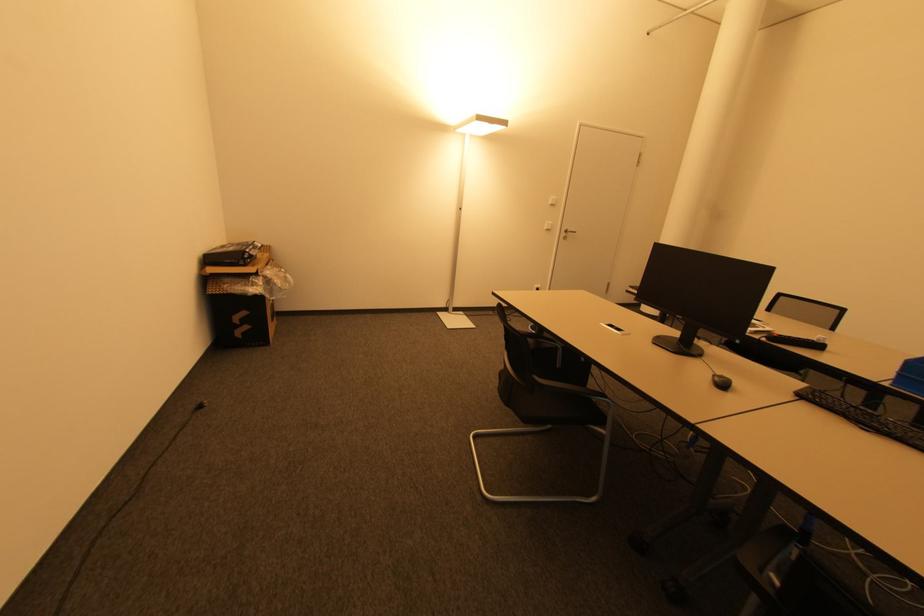
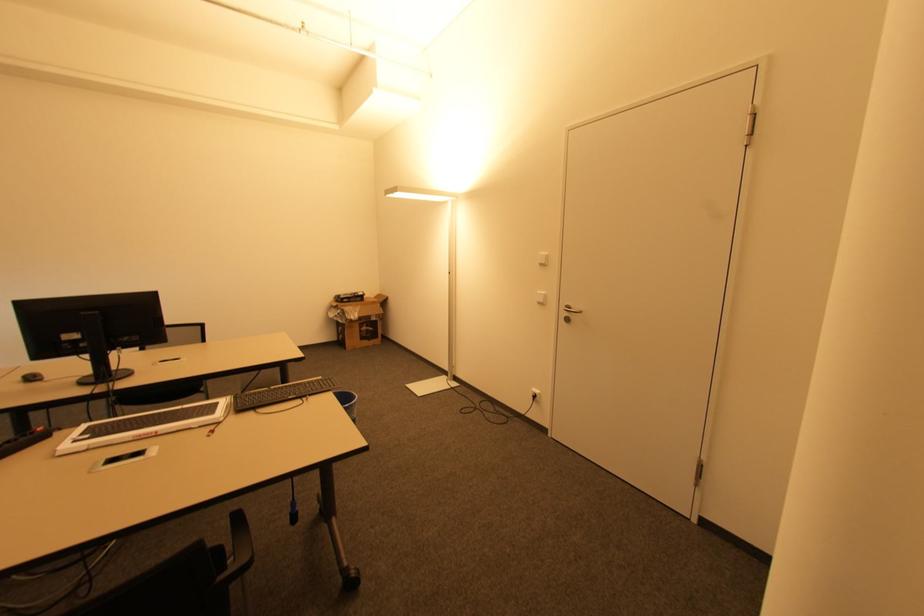
Find the pixel in the second image that matches (x=550, y=230) in the first image.

(541, 302)